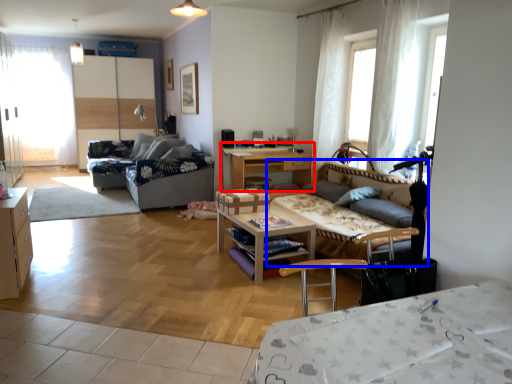
Question: Which object appears farthest to the camera in this image, table (highlighted by a red box) or studio couch (highlighted by a blue box)?

Choices:
 (A) table
 (B) studio couch

Answer: (A)